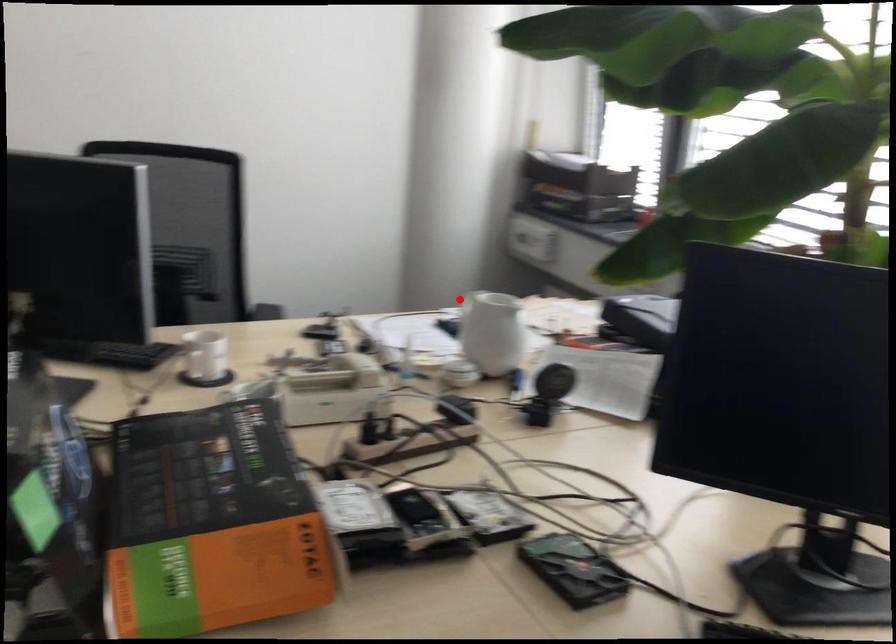
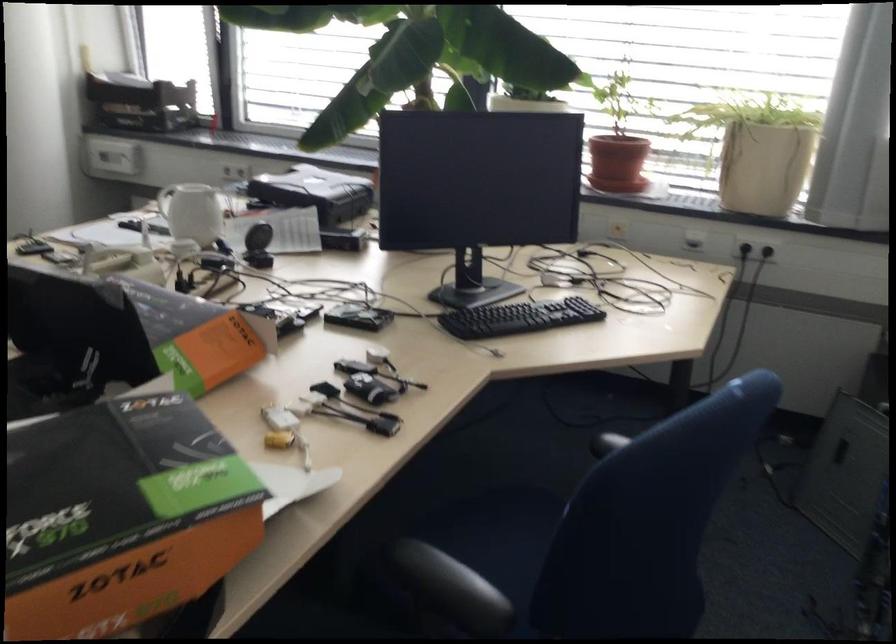
Find the pixel in the second image that matches the highlighted location in the first image.

(165, 200)